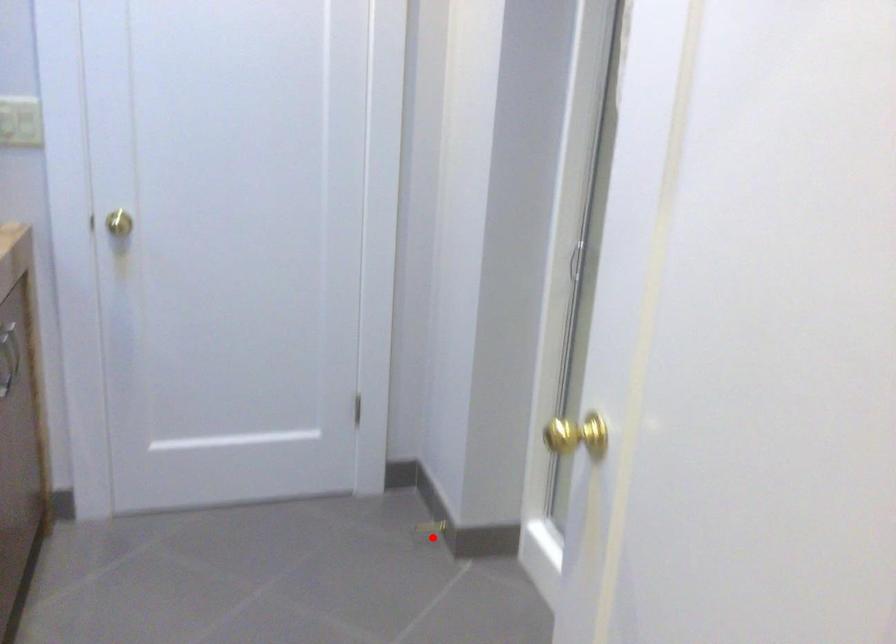
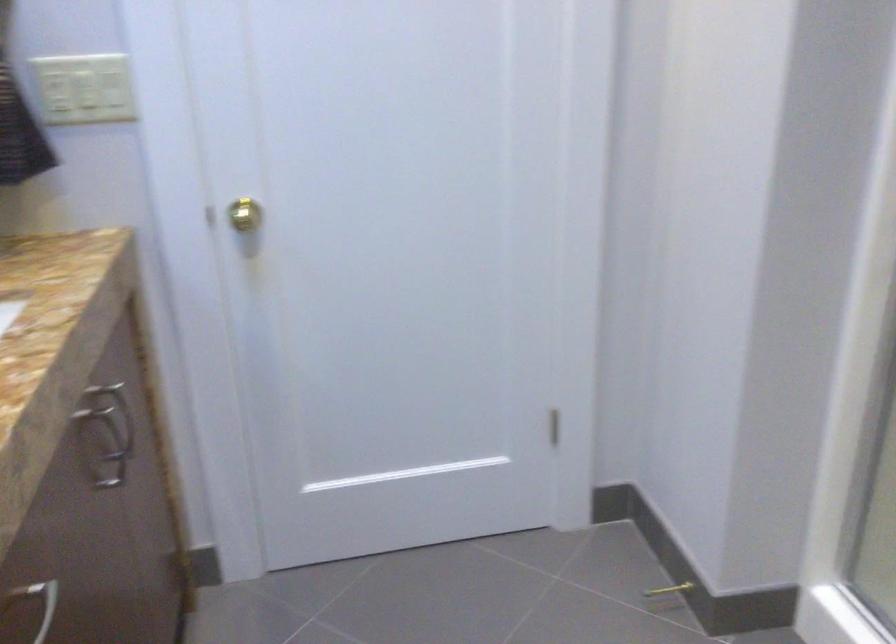
Locate, in the second image, the point that corresponds to the highlighted location in the first image.

(666, 596)